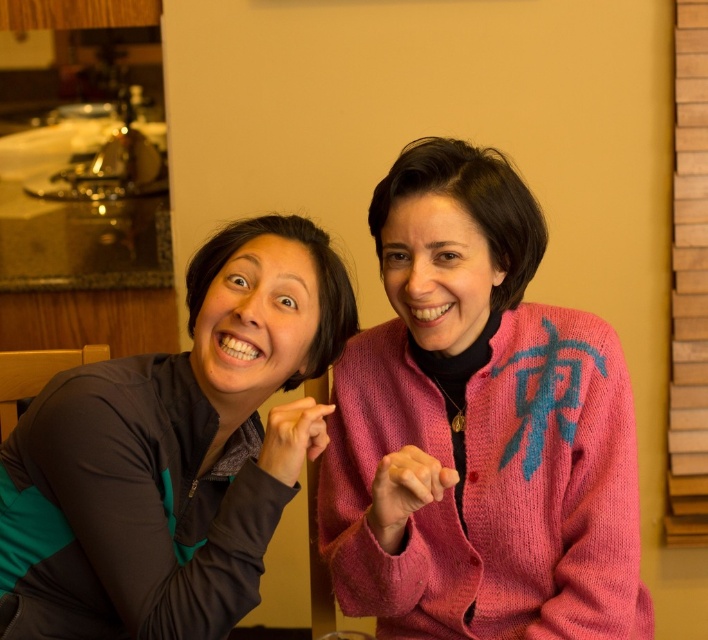
Question: Which of the following is the farthest from the observer?

Choices:
 (A) (588, 445)
 (B) (93, 467)

Answer: (A)

Question: Can you confirm if pink knitted sweater at center is positioned to the left of teal fabric jacket at left?

Choices:
 (A) yes
 (B) no

Answer: (B)

Question: Which point appears closest to the camera in this image?

Choices:
 (A) (493, 536)
 (B) (88, 374)

Answer: (B)

Question: Is pink knitted sweater at center closer to the viewer compared to teal fabric jacket at left?

Choices:
 (A) no
 (B) yes

Answer: (A)

Question: Does pink knitted sweater at center appear over teal fabric jacket at left?

Choices:
 (A) no
 (B) yes

Answer: (B)

Question: Which point is farther to the camera?

Choices:
 (A) (178, 618)
 (B) (515, 408)

Answer: (B)